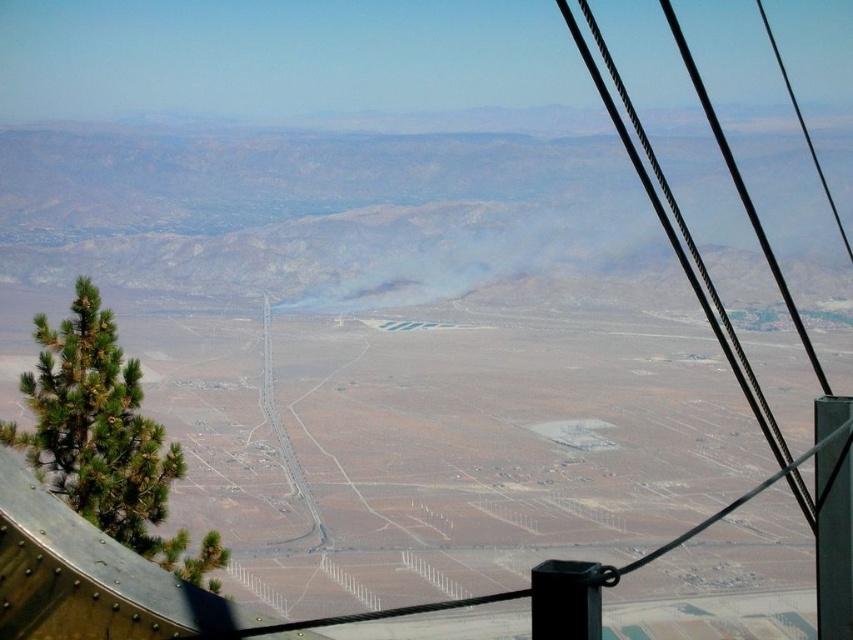
Question: Which point is closer to the camera?

Choices:
 (A) black metal pole at right
 (B) metallic wire at right
 (C) brown rocky mountain at center

Answer: (B)

Question: Which of the following is the closest to the observer?

Choices:
 (A) brown rocky mountain at center
 (B) black metal pole at right
 (C) metallic wire at right

Answer: (C)

Question: Which of the following is the closest to the observer?

Choices:
 (A) brown rocky mountain at center
 (B) black metal pole at right
 (C) metallic wire at right

Answer: (C)

Question: Where is brown rocky mountain at center located in relation to metallic wire at right in the image?

Choices:
 (A) below
 (B) above

Answer: (B)

Question: Is brown rocky mountain at center bigger than black metal pole at right?

Choices:
 (A) no
 (B) yes

Answer: (B)

Question: Can you confirm if brown rocky mountain at center is positioned to the left of black metal pole at right?

Choices:
 (A) no
 (B) yes

Answer: (B)